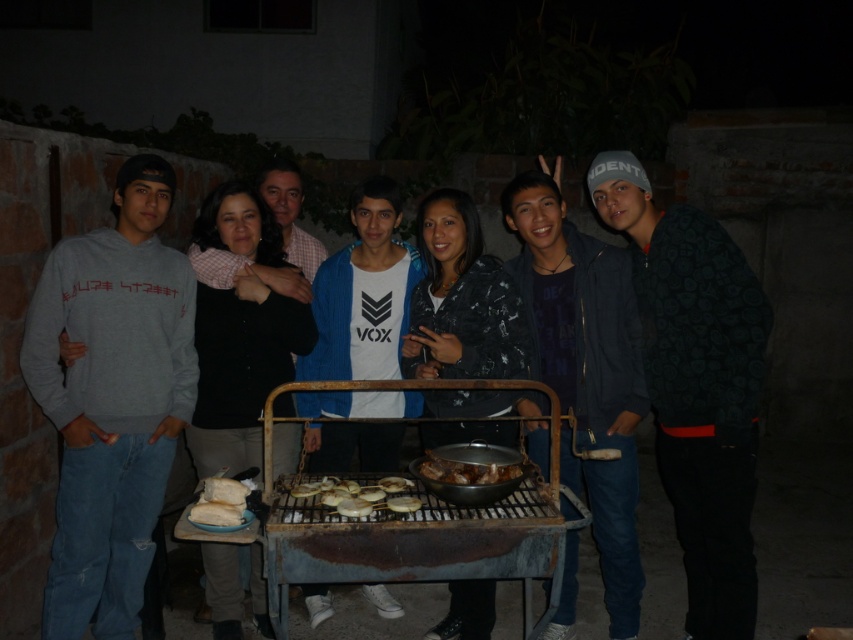
Question: Among these points, which one is farthest from the camera?

Choices:
 (A) (146, 301)
 (B) (576, 433)
 (C) (403, 502)
 (D) (424, 461)

Answer: (B)

Question: Is dark blue jacket at center positioned before golden crispy onion at center?

Choices:
 (A) yes
 (B) no

Answer: (B)

Question: Is gray sweatshirt at left wider than dark green textured jacket at right?

Choices:
 (A) no
 (B) yes

Answer: (A)

Question: Considering the real-world distances, which object is closest to the rusty metal grill at center?

Choices:
 (A) dark green textured jacket at right
 (B) shiny metallic bowl at center
 (C) golden crispy bread at center

Answer: (B)

Question: From the image, what is the correct spatial relationship of dark blue jacket at center in relation to white matte bread at center?

Choices:
 (A) below
 (B) above

Answer: (B)

Question: Which of these objects is positioned farthest from the white matte bread at center?

Choices:
 (A) golden crispy onion at center
 (B) white bread at lower left
 (C) shiny metallic bowl at center

Answer: (B)